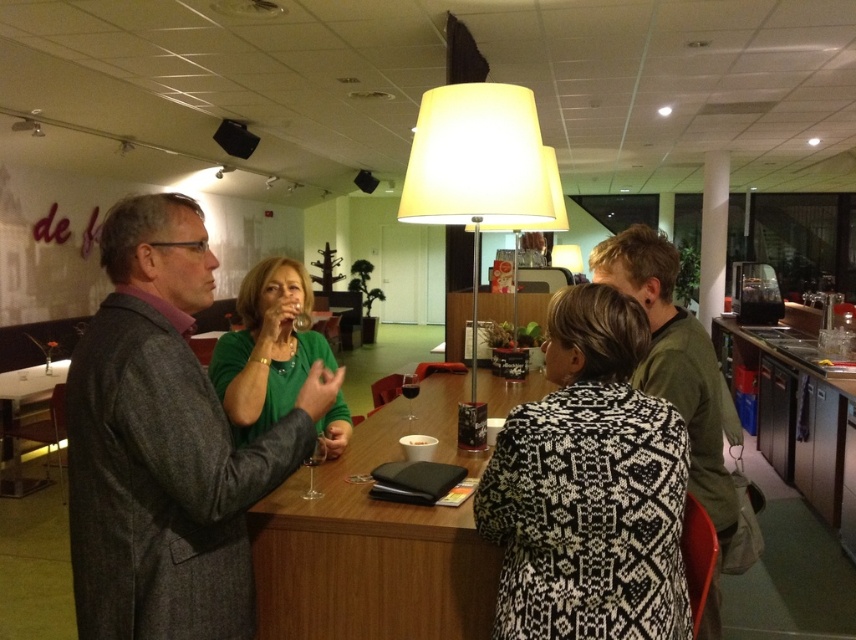
Question: Which point is closer to the camera?

Choices:
 (A) gray wool coat at center
 (B) wooden table at center

Answer: (A)

Question: Estimate the real-world distances between objects in this image. Which object is closer to the green cotton shirt at center?

Choices:
 (A) wooden table at center
 (B) green matte shirt at center

Answer: (A)

Question: Does gray wool coat at center appear on the left side of wooden table at center?

Choices:
 (A) yes
 (B) no

Answer: (A)

Question: Is wooden table at center below green cotton shirt at center?

Choices:
 (A) no
 (B) yes

Answer: (B)

Question: Observing the image, what is the correct spatial positioning of wooden table at center in reference to green cotton shirt at center?

Choices:
 (A) below
 (B) above

Answer: (A)

Question: Which of the following is the farthest from the observer?

Choices:
 (A) wooden table at center
 (B) green cotton shirt at center
 (C) gray wool coat at center
 (D) black and white knitted sweater at center

Answer: (A)